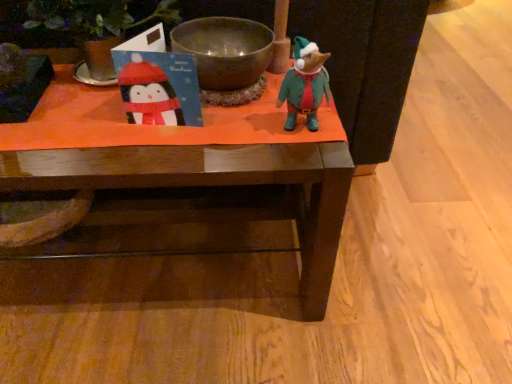
Question: Is wooden table at center situated inside green felt mouse at center or outside?

Choices:
 (A) inside
 (B) outside

Answer: (B)

Question: In the image, is wooden table at center positioned in front of or behind green felt mouse at center?

Choices:
 (A) behind
 (B) front

Answer: (A)

Question: Estimate the real-world distances between objects in this image. Which object is farther from the shiny metallic bowl at center?

Choices:
 (A) green felt mouse at center
 (B) wooden table at center

Answer: (B)

Question: Which is farther from the wooden table at center?

Choices:
 (A) shiny metallic bowl at center
 (B) green felt mouse at center

Answer: (B)